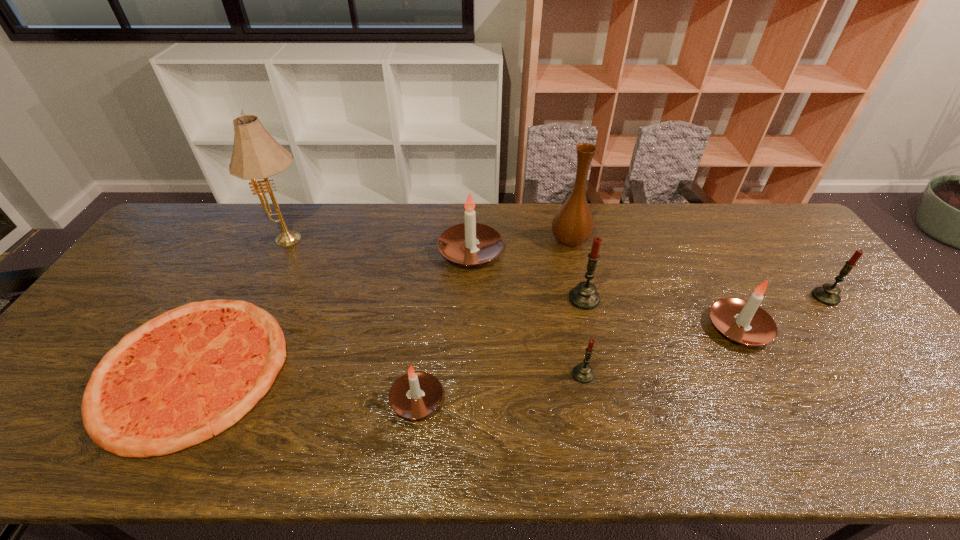
The width and height of the screenshot is (960, 540). Find the location of `red candle identified as the second closest to the vase`. red candle identified as the second closest to the vase is located at coordinates (583, 373).

Locate which red candle is the third closest to the second candle from right to left. Please provide its 2D coordinates. Your answer should be formatted as a tuple, i.e. [(x, y)], where the tuple contains the x and y coordinates of a point satisfying the conditions above.

[(583, 373)]

This screenshot has width=960, height=540. I want to click on white candle identified as the third closest to the nearest red candle, so click(458, 243).

Select which white candle appears as the second closest to the tallest object. Please provide its 2D coordinates. Your answer should be formatted as a tuple, i.e. [(x, y)], where the tuple contains the x and y coordinates of a point satisfying the conditions above.

[(414, 395)]

Where is `vacant region that satisfies the following two spatial constraints: 1. on the front side of the biggest white candle; 2. on the left side of the eighth object from left to right`? This screenshot has height=540, width=960. vacant region that satisfies the following two spatial constraints: 1. on the front side of the biggest white candle; 2. on the left side of the eighth object from left to right is located at coordinates (468, 328).

Image resolution: width=960 pixels, height=540 pixels. Find the location of `free space that satisfies the following two spatial constraints: 1. on the back side of the tallest object; 2. on the left side of the vase`. free space that satisfies the following two spatial constraints: 1. on the back side of the tallest object; 2. on the left side of the vase is located at coordinates (291, 241).

This screenshot has height=540, width=960. I want to click on free spot that satisfies the following two spatial constraints: 1. on the back side of the rightmost red candle; 2. on the right side of the pizza, so click(x=232, y=297).

The width and height of the screenshot is (960, 540). I want to click on vacant space that satisfies the following two spatial constraints: 1. on the front side of the beige lampshade; 2. on the left side of the rightmost object, so click(264, 297).